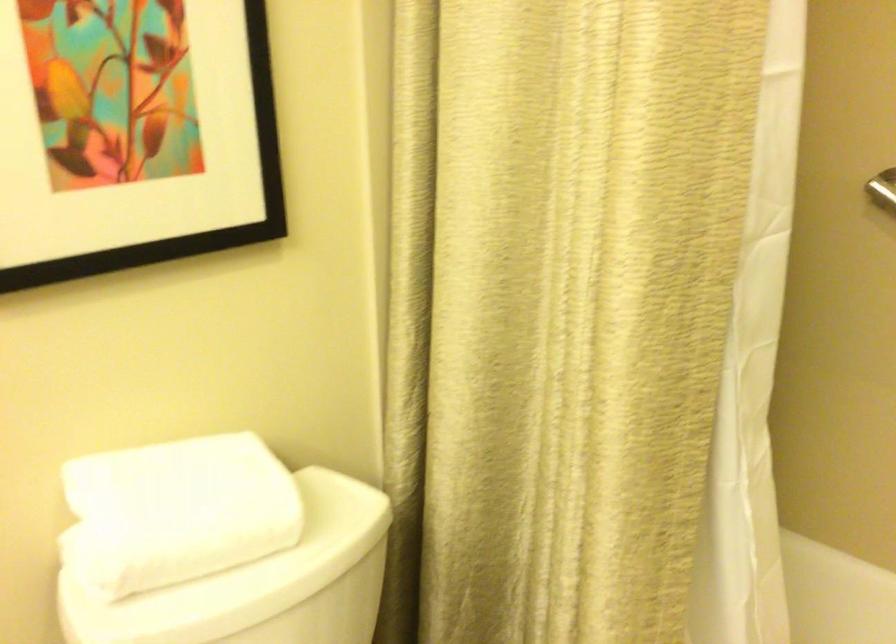
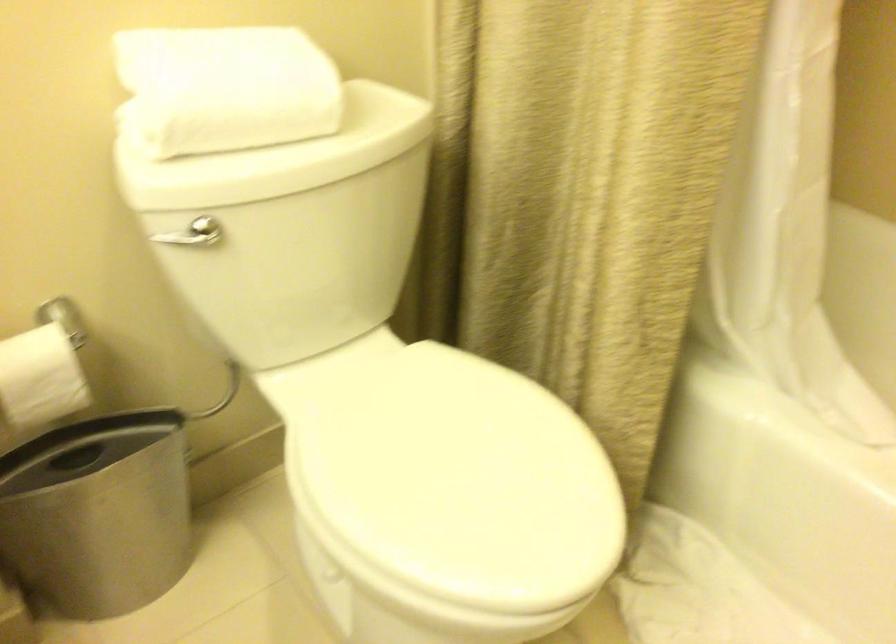
Where in the second image is the point corresponding to [186,526] from the first image?

(225, 88)